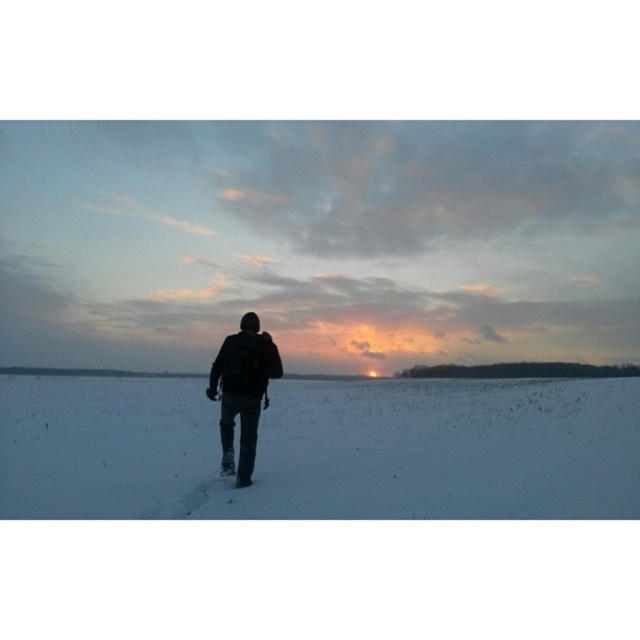
You are navigating a snowshoeing trail and need to place your black matte snowshoe at center exactly where the snow is deepest. According to the scene description, where should you position it?

The black matte snowshoe at center should be placed at point (317, 243) as specified in the scene description.

You are standing at the point marked as point (317,243) and want to walk towards the horizon where the line of trees is. What object will you step on first?

The first object you will step on is the black matte snowshoe at center located at point (317,243).

You are an AI analyzing the winter scene. The white powdery snow at center is part of the landscape. What is its exact 2D coordinate location in the image?

The white powdery snow at center is located at the 2D coordinate point of (x=323, y=449).